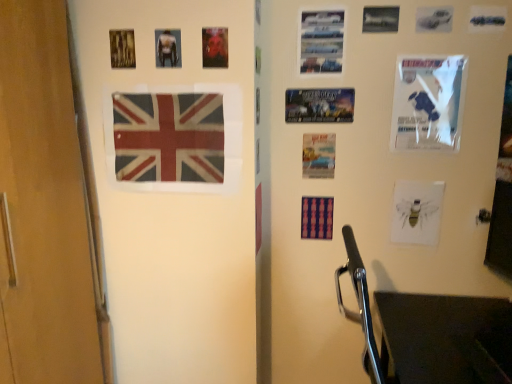
Question: Visually, is matte paper poster at center, the sixth poster page viewed from the left, positioned to the left or to the right of metallic silver airplane at upper right, which appears as the 7th poster page when viewed from the left?

Choices:
 (A) right
 (B) left

Answer: (B)

Question: In the image, is matte paper poster at center, placed as the sixth poster page when sorted from right to left, positioned in front of or behind metallic silver airplane at upper right, which ranks as the 5th poster page in right-to-left order?

Choices:
 (A) front
 (B) behind

Answer: (B)

Question: Which object is positioned closest to the matte plastic flag at center, the first flag positioned from the bottom?

Choices:
 (A) matte paper bee at lower right, the eighth poster page in the left-to-right sequence
 (B) white glossy poster at upper right, acting as the second poster page starting from the right
 (C) metallic silver cars at upper right, which is the 5th poster page in left-to-right order
 (D) matte plastic poster at upper center, the 9th poster page positioned from the right
 (E) matte paper poster at center, placed as the sixth poster page when sorted from right to left

Answer: (E)

Question: Which of these objects is positioned farthest from the white glossy poster at upper right, the ninth poster page from the left?

Choices:
 (A) matte black shirt at upper center, arranged as the 2th poster page when viewed from the left
 (B) matte paper poster at center, the sixth poster page viewed from the left
 (C) textured fabric flag at left, positioned as the second flag in right-to-left order
 (D) metallic silver poster at center, arranged as the 8th poster page when viewed from the right
 (E) matte paper bee at lower right, the eighth poster page in the left-to-right sequence

Answer: (A)